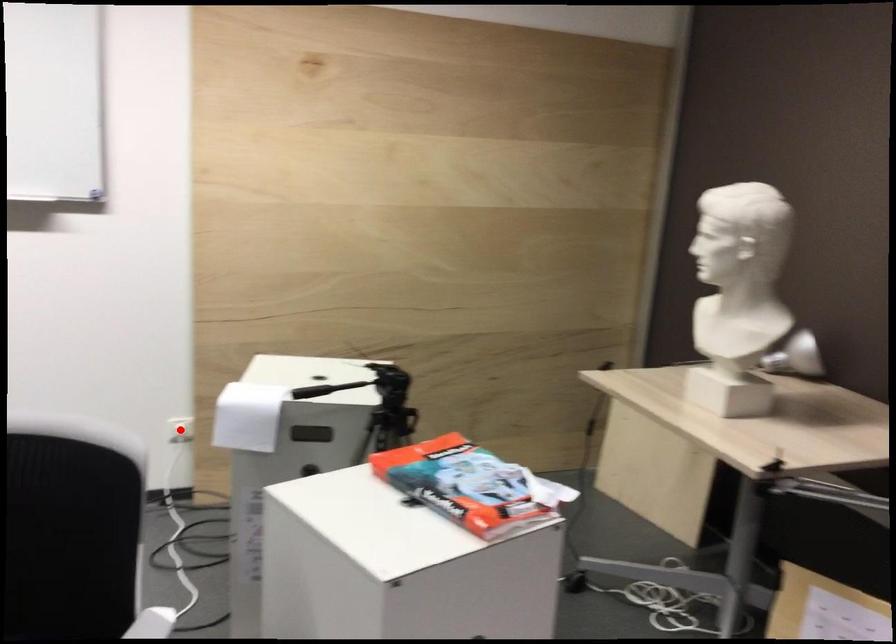
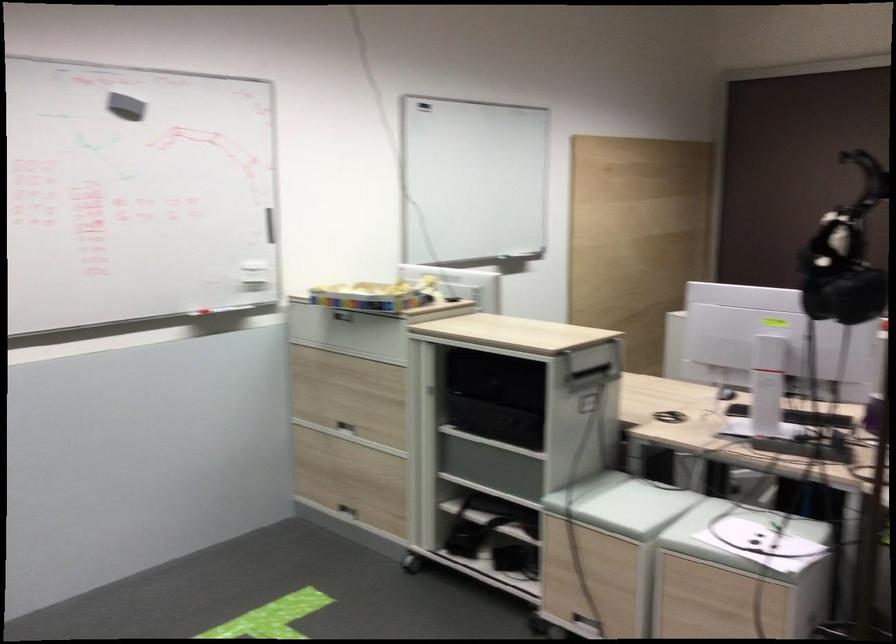
Question: I am providing you with two images of the same scene from different viewpoints. A red point is marked on the first image. At the location where the point appears in image 1, is it still visible in image 2?

Choices:
 (A) Yes
 (B) No

Answer: (B)